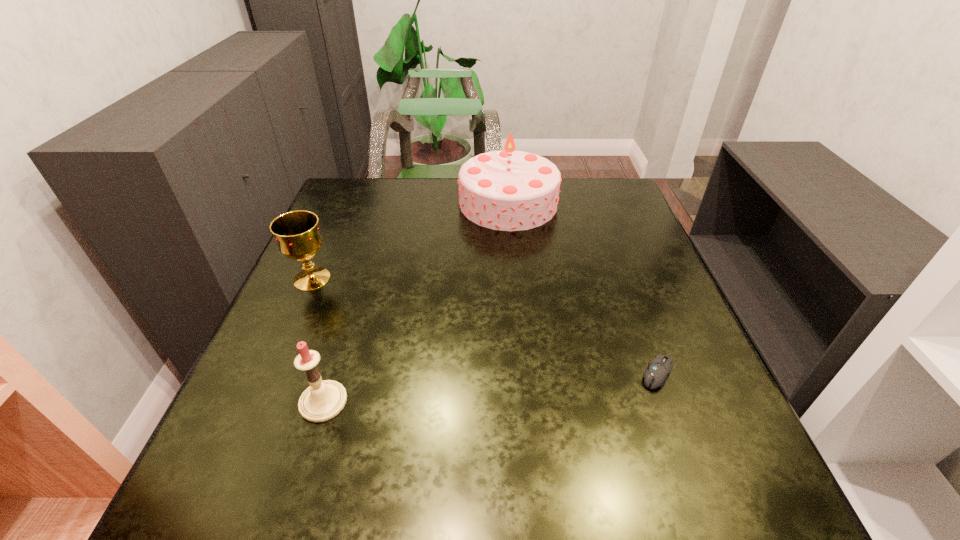
Where is `the farthest object`? the farthest object is located at coordinates (508, 190).

I want to click on the tallest object, so click(508, 190).

You are a GUI agent. You are given a task and a screenshot of the screen. Output one action in this format:
    pyautogui.click(x=<x>, y=<y>)
    Task: Click on the leftmost object
    Image resolution: width=960 pixels, height=540 pixels.
    Given the screenshot: What is the action you would take?
    pyautogui.click(x=297, y=234)

You are a GUI agent. You are given a task and a screenshot of the screen. Output one action in this format:
    pyautogui.click(x=<x>, y=<y>)
    Task: Click on the second farthest object
    The width and height of the screenshot is (960, 540).
    Given the screenshot: What is the action you would take?
    coord(297,234)

Locate an element on the screen. Image resolution: width=960 pixels, height=540 pixels. candle is located at coordinates (322, 400).

The image size is (960, 540). I want to click on computer mouse, so pos(655,375).

Find the location of a particular element. the rightmost object is located at coordinates (655, 375).

Find the location of a particular element. vacant space situated 0.170m on the front of the farthest object is located at coordinates (515, 273).

What are the coordinates of `vacant space located 0.150m on the right of the leftmost object` in the screenshot? It's located at (397, 279).

Find the location of a particular element. The width and height of the screenshot is (960, 540). blank area located on the right of the second object from left to right is located at coordinates (521, 402).